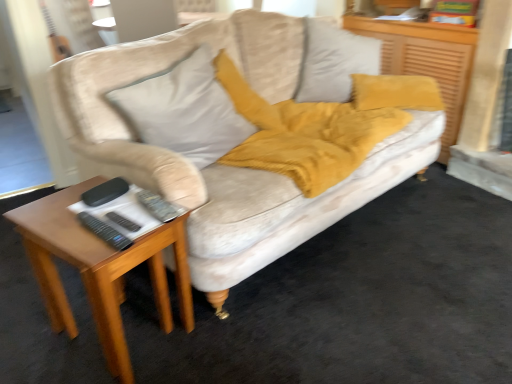
Question: From a real-world perspective, is velvet beige couch at center over black plastic remote at lower left, the 1th remote when ordered from back to front?

Choices:
 (A) yes
 (B) no

Answer: (B)

Question: Does velvet beige couch at center appear on the right side of black plastic remote at lower left, the 1th remote when ordered from back to front?

Choices:
 (A) no
 (B) yes

Answer: (A)

Question: From the image's perspective, is velvet beige couch at center on top of black plastic remote at lower left, the 2th remote from the front?

Choices:
 (A) no
 (B) yes

Answer: (B)

Question: Is velvet beige couch at center not close to black plastic remote at lower left, the 2th remote from the front?

Choices:
 (A) yes
 (B) no

Answer: (B)

Question: Is velvet beige couch at center taller than black plastic remote at lower left, the 2th remote from the front?

Choices:
 (A) no
 (B) yes

Answer: (B)

Question: Is velvet beige couch at center further to camera compared to black plastic remote at lower left, the 2th remote from the front?

Choices:
 (A) no
 (B) yes

Answer: (A)

Question: Does black plastic remote at lower left, the 2th remote from the front, turn towards black plastic remote at lower left, which is the 2th remote in back-to-front order?

Choices:
 (A) yes
 (B) no

Answer: (B)

Question: Are black plastic remote at lower left, the 1th remote when ordered from back to front, and black plastic remote at lower left, which is counted as the first remote, starting from the front, making contact?

Choices:
 (A) no
 (B) yes

Answer: (B)

Question: From a real-world perspective, is black plastic remote at lower left, the 2th remote from the front, located beneath black plastic remote at lower left, which is the 2th remote in back-to-front order?

Choices:
 (A) no
 (B) yes

Answer: (B)

Question: From the image's perspective, is black plastic remote at lower left, the 2th remote from the front, located above black plastic remote at lower left, which is the 2th remote in back-to-front order?

Choices:
 (A) yes
 (B) no

Answer: (A)

Question: Would you say black plastic remote at lower left, the 2th remote from the front, is outside black plastic remote at lower left, which is the 2th remote in back-to-front order?

Choices:
 (A) no
 (B) yes

Answer: (B)

Question: From the image's perspective, is black plastic remote at lower left, the 2th remote from the front, under black plastic remote at lower left, which is the 2th remote in back-to-front order?

Choices:
 (A) no
 (B) yes

Answer: (A)

Question: Can you confirm if woodenmaterial/texturetable at left is positioned to the left of velvet mustard pillow at upper right?

Choices:
 (A) yes
 (B) no

Answer: (A)